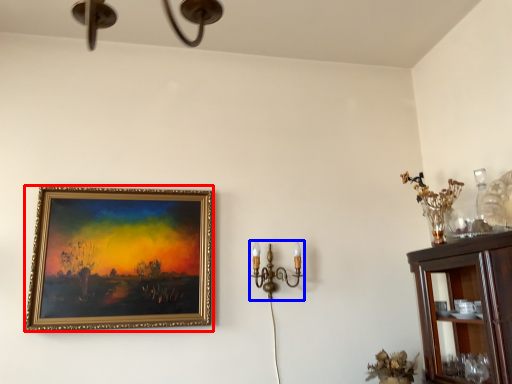
Question: Among these objects, which one is nearest to the camera, picture frame (highlighted by a red box) or candle holder (highlighted by a blue box)?

Choices:
 (A) picture frame
 (B) candle holder

Answer: (A)